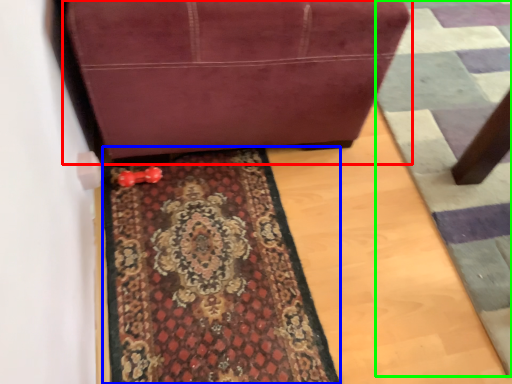
Question: Estimate the real-world distances between objects in this image. Which object is closer to furniture (highlighted by a red box), mat (highlighted by a blue box) or doormat (highlighted by a green box)?

Choices:
 (A) mat
 (B) doormat

Answer: (A)